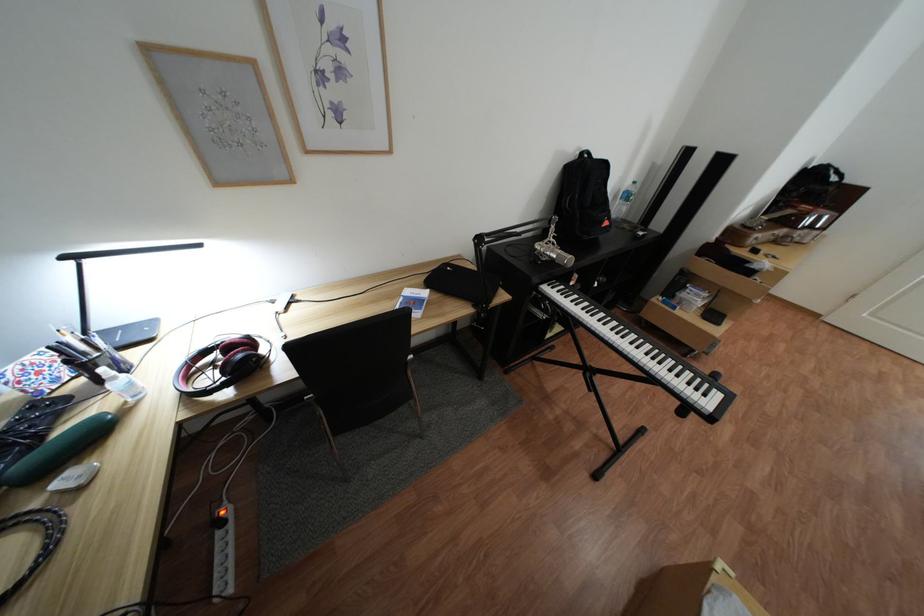
Where is `power strip switch`? This screenshot has height=616, width=924. power strip switch is located at coordinates (224, 551).